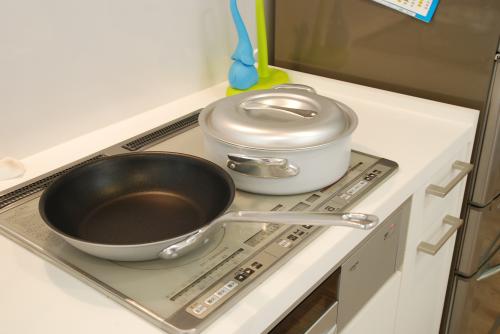
This screenshot has width=500, height=334. In order to click on white wall in this screenshot , I will do `click(114, 47)`.